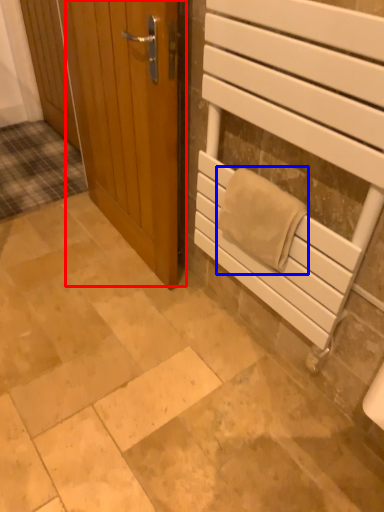
Question: Among these objects, which one is nearest to the camera, door (highlighted by a red box) or bath towel (highlighted by a blue box)?

Choices:
 (A) door
 (B) bath towel

Answer: (B)